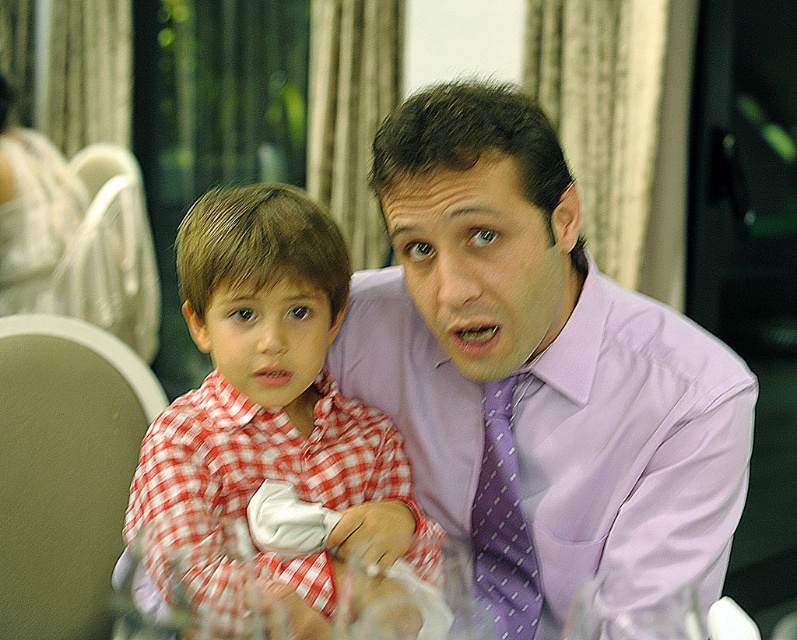
Question: Does purple satin dress shirt at center have a larger size compared to purple dotted tie at center?

Choices:
 (A) no
 (B) yes

Answer: (B)

Question: Which object appears closest to the camera in this image?

Choices:
 (A) red checkered shirt at center
 (B) purple dotted tie at center

Answer: (A)

Question: Is purple satin dress shirt at center thinner than purple dotted tie at center?

Choices:
 (A) yes
 (B) no

Answer: (B)

Question: In this image, where is purple satin dress shirt at center located relative to red checkered shirt at center?

Choices:
 (A) left
 (B) right

Answer: (B)

Question: Which point is farther to the camera?

Choices:
 (A) purple dotted tie at center
 (B) red checkered shirt at center
 (C) purple satin dress shirt at center

Answer: (A)

Question: Among these points, which one is farthest from the camera?

Choices:
 (A) (305, 465)
 (B) (485, 556)
 (C) (735, 435)

Answer: (B)